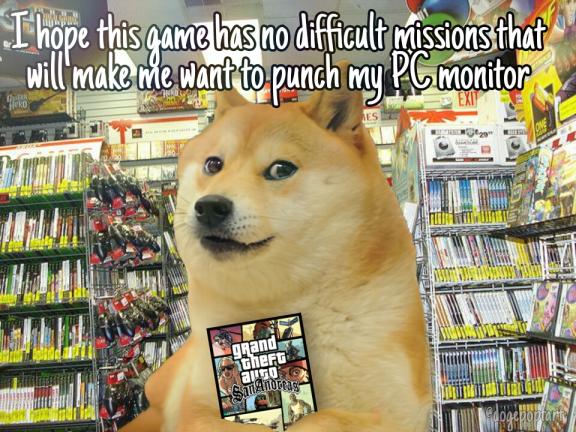
Find the location of a particular element. This screenshot has width=576, height=432. wall is located at coordinates (101, 109), (434, 96).